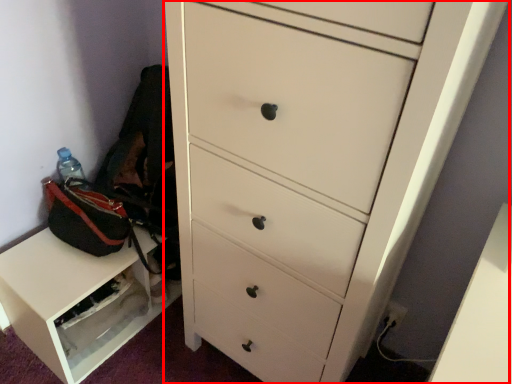
Question: From the image's perspective, what is the correct spatial relationship of chest of drawers (annotated by the red box) in relation to cabinetry?

Choices:
 (A) below
 (B) above

Answer: (B)